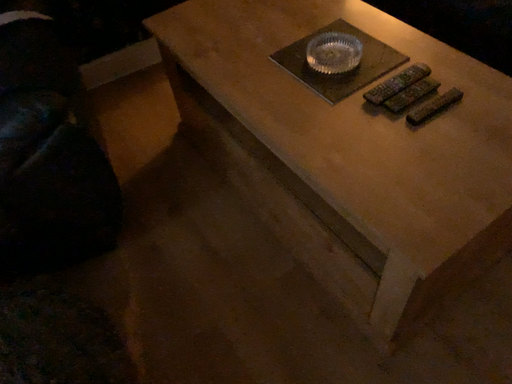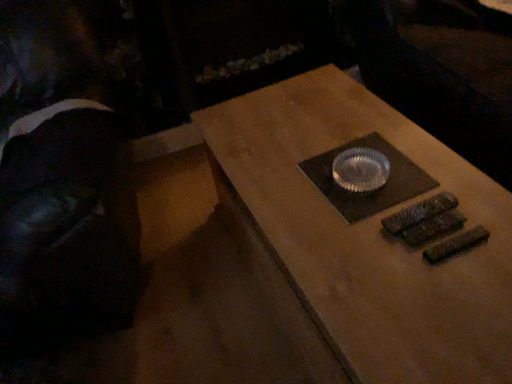
Question: How did the camera likely rotate when shooting the video?

Choices:
 (A) rotated downward
 (B) rotated upward

Answer: (B)